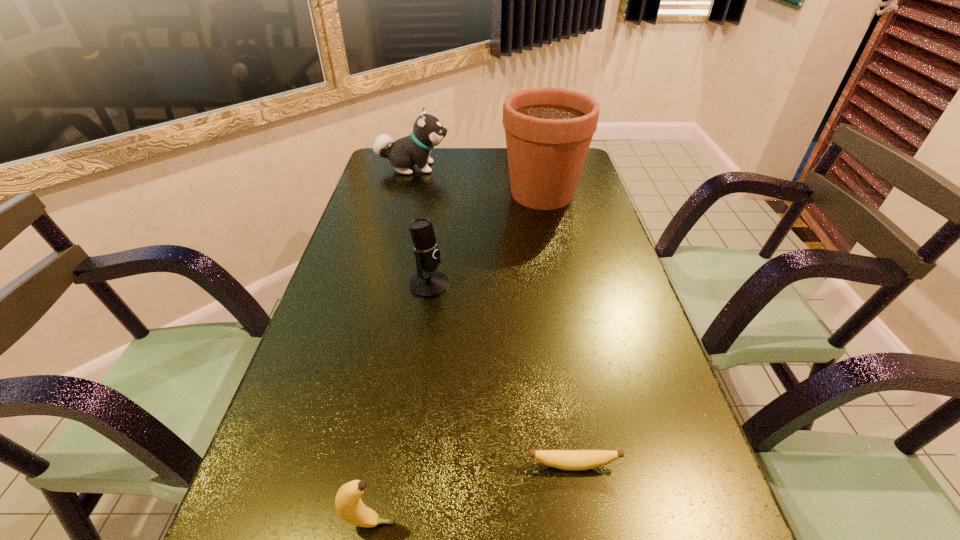
Image resolution: width=960 pixels, height=540 pixels. In the image, there is a desktop. In order to click on blank space at the left edge in this screenshot , I will do `click(320, 444)`.

Image resolution: width=960 pixels, height=540 pixels. In order to click on vacant point at the right edge in this screenshot , I will do `click(589, 201)`.

The image size is (960, 540). I want to click on vacant area at the far right corner, so click(581, 179).

Locate an element on the screen. Image resolution: width=960 pixels, height=540 pixels. empty location between the shorter banana and the puppy is located at coordinates (492, 316).

You are a GUI agent. You are given a task and a screenshot of the screen. Output one action in this format:
    pyautogui.click(x=<x>, y=<y>)
    Task: Click on the blank region between the nearest object and the third farthest object
    
    Given the screenshot: What is the action you would take?
    pyautogui.click(x=399, y=404)

Locate an element on the screen. The width and height of the screenshot is (960, 540). free area in between the second shortest object and the second nearest object is located at coordinates (471, 494).

Locate an element on the screen. unoccupied position between the microphone and the right banana is located at coordinates (501, 375).

Identify the location of free spot between the farther banana and the nearer banana. The image size is (960, 540). point(471,494).

I want to click on free area in between the farther banana and the third farthest object, so click(501, 375).

At what (x,y) coordinates should I click in order to perform the action: click on vacant space in between the farther banana and the microphone. Please return your answer as a coordinate pair (x, y). The width and height of the screenshot is (960, 540). Looking at the image, I should click on (501, 375).